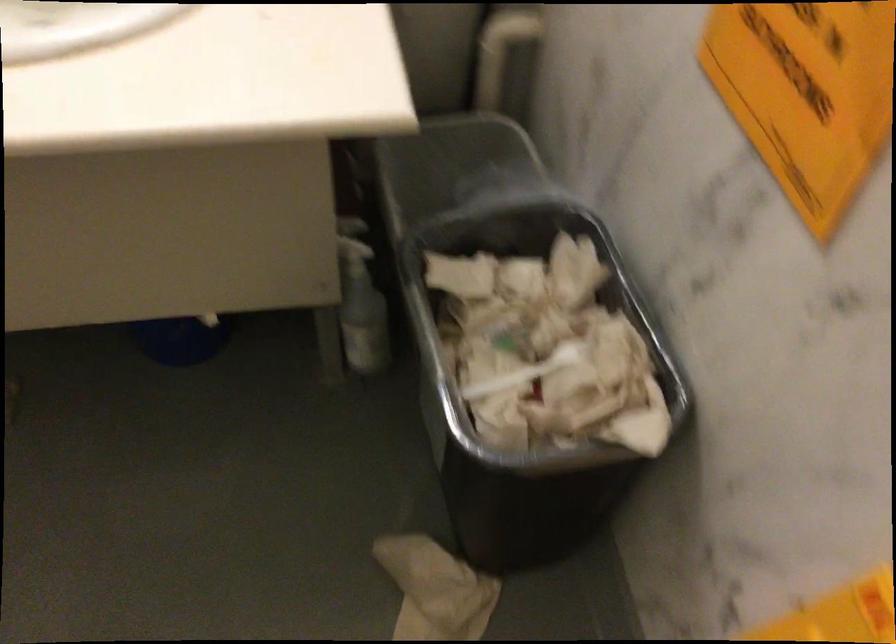
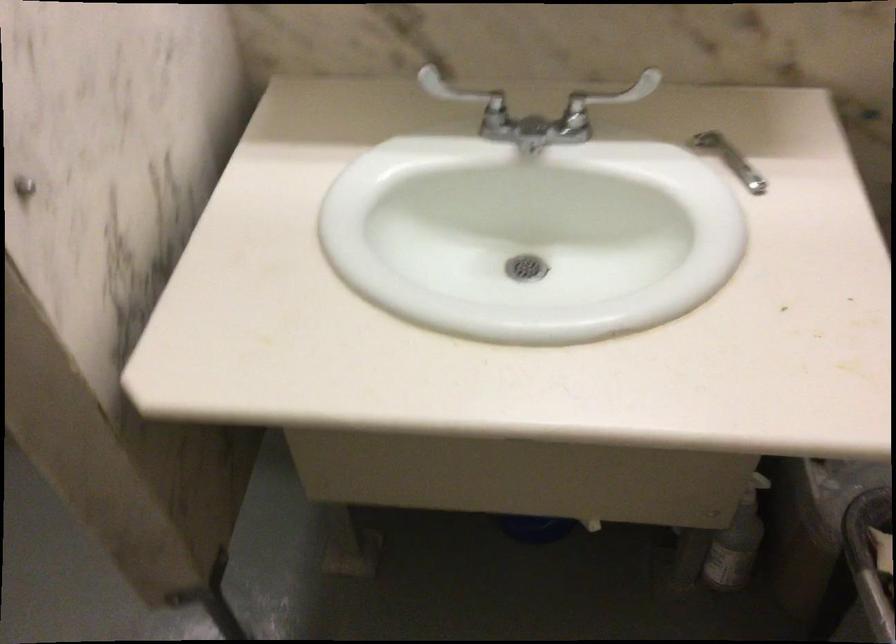
Locate, in the second image, the point that corresponds to point (364, 319) in the first image.

(737, 542)